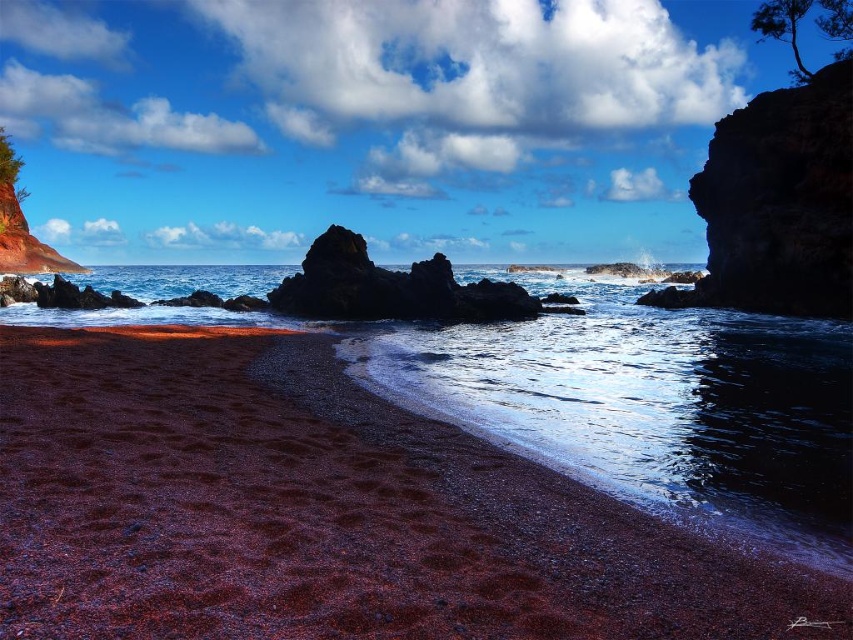
In the scene shown: You are a hiker who wants to place a 150 feet long tent between the smooth dark rock at center and the green rough tree at upper left. Can the tent fit between them without overlapping either object?

The smooth dark rock at center and green rough tree at upper left are 155.31 feet apart, so the 150 feet long tent can fit between them without overlapping either object.

You are standing at the shoreline looking out towards the ocean. There are two points marked in the image. Which of the two points, point [711,608] or point [843,3], is closer to you?

Point [711,608] is closer to the camera than point [843,3].

You are standing on the red sand beach in the image and notice a specific point marked at coordinates (325, 513). What is located at that point?

The point at coordinates (325, 513) indicates dark red gravel at lower left.